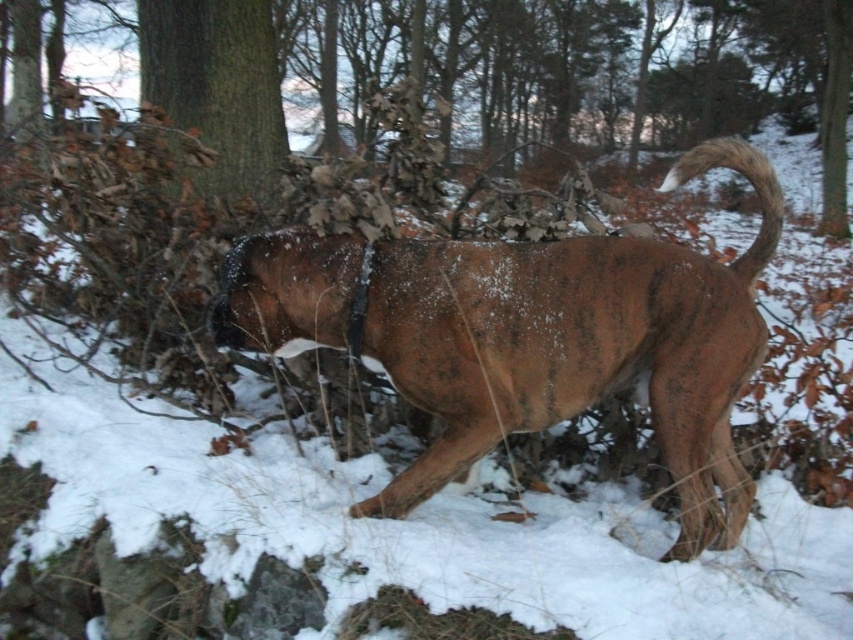
Consider the image. Between brown fur dog at center and brown bark tree at center, which one appears on the left side from the viewer's perspective?

brown fur dog at center

Can you confirm if brown fur dog at center is wider than brown bark tree at center?

No, brown fur dog at center is not wider than brown bark tree at center.

Does point (276, 340) lie in front of point (300, 72)?

Yes, point (276, 340) is closer to viewer.

I want to click on brown fur dog at center, so click(578, 346).

Is brown bark tree at center to the right of brown rough bark at upper center from the viewer's perspective?

Correct, you'll find brown bark tree at center to the right of brown rough bark at upper center.

Between point (639, 115) and point (215, 72), which one is positioned in front?

Positioned in front is point (215, 72).

Identify the location of brown bark tree at center. (647, 72).

Between brown fur dog at center and brown rough bark at upper center, which one is positioned higher?

Positioned higher is brown rough bark at upper center.

Is brown fur dog at center in front of brown rough bark at upper center?

Yes, brown fur dog at center is closer to the viewer.

Measure the distance between point (688,256) and camera.

11.43 feet

At what (x,y) coordinates should I click in order to perform the action: click on brown fur dog at center. Please return your answer as a coordinate pair (x, y). This screenshot has width=853, height=640. Looking at the image, I should click on pyautogui.click(x=578, y=346).